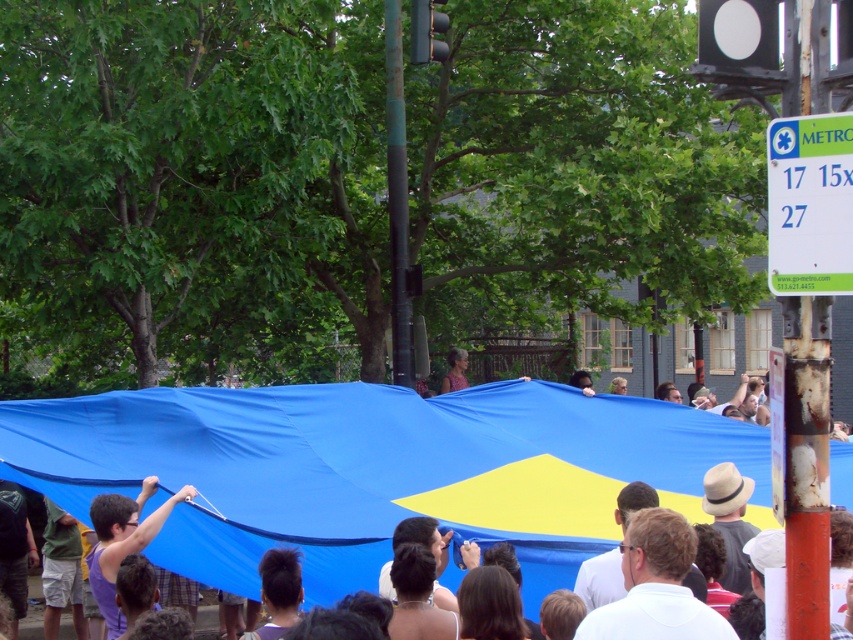
Is purple fabric at center bigger than matte brown hair at center?

Indeed, purple fabric at center has a larger size compared to matte brown hair at center.

Is purple fabric at center below matte brown hair at center?

Yes.

Is point (94, 497) positioned after point (463, 352)?

No, it is in front of (463, 352).

At what (x,y) coordinates should I click in order to perform the action: click on purple fabric at center. Please return your answer as a coordinate pair (x, y). The image size is (853, 640). Looking at the image, I should click on (122, 541).

Does green plastic sign at upper right have a lesser height compared to white matte shirt at center?

No, green plastic sign at upper right is not shorter than white matte shirt at center.

Is green plastic sign at upper right above white matte shirt at center?

Yes, green plastic sign at upper right is above white matte shirt at center.

This screenshot has height=640, width=853. In order to click on green plastic sign at upper right in this screenshot , I will do `click(810, 204)`.

Does blue tarpaulin at center lie in front of white matte shirt at center?

No, it is behind white matte shirt at center.

Between point (599, 531) and point (592, 637), which one is positioned in front?

Positioned in front is point (592, 637).

The image size is (853, 640). Identify the location of blue tarpaulin at center. (375, 470).